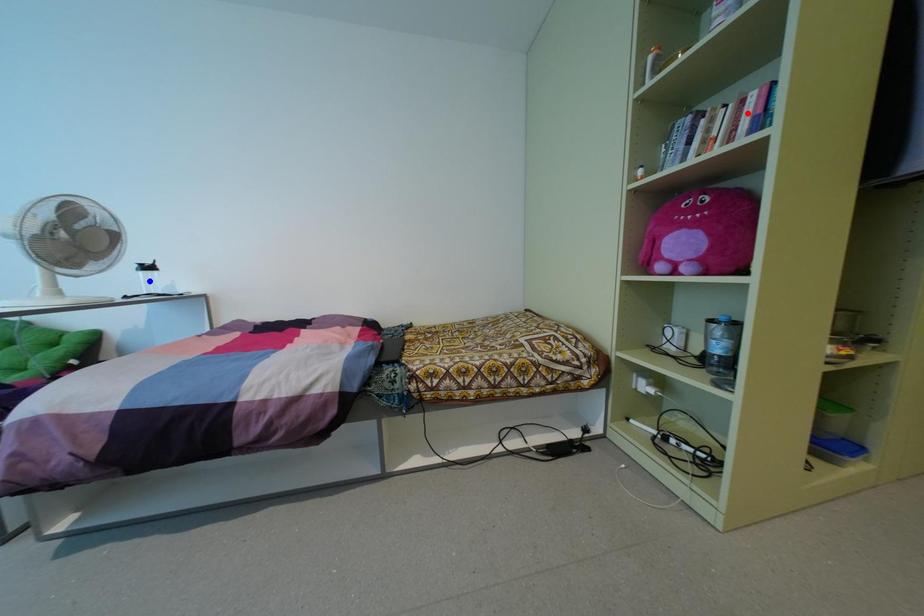
Question: Which of the two points in the image is closer to the camera?

Choices:
 (A) Blue point is closer.
 (B) Red point is closer.

Answer: (B)